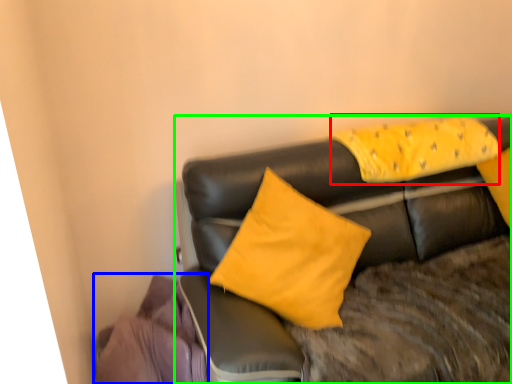
Question: Based on their relative distances, which object is farther from pillow (highlighted by a red box)? Choose from material (highlighted by a blue box) and studio couch (highlighted by a green box).

Choices:
 (A) material
 (B) studio couch

Answer: (A)